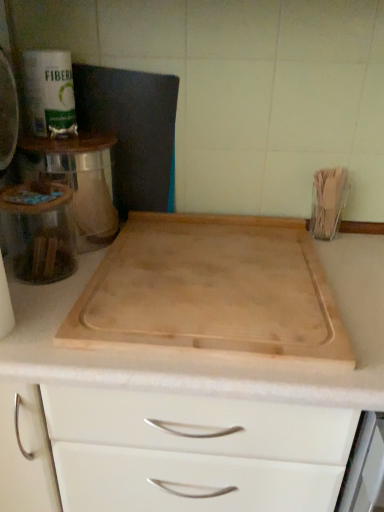
Question: Considering the positions of point (1, 118) and point (34, 283), is point (1, 118) closer or farther from the camera than point (34, 283)?

Choices:
 (A) closer
 (B) farther

Answer: (A)

Question: From their relative heights in the image, would you say metallic silver toaster at upper left, which is counted as the 1th appliance, starting from the top, is taller or shorter than clear glass jar at left, which ranks as the first appliance in right-to-left order?

Choices:
 (A) tall
 (B) short

Answer: (A)

Question: Which object is positioned farthest from the natural wood cutting board at center?

Choices:
 (A) clear glass jar at left, the second appliance positioned from the left
 (B) metallic silver toaster at upper left, which is the first appliance from left to right
 (C) natural wood cutting board at center

Answer: (B)

Question: Which is nearer to the natural wood cutting board at center?

Choices:
 (A) metallic silver toaster at upper left, which ranks as the 2th appliance in right-to-left order
 (B) natural wood cutting board at center
 (C) clear glass jar at left, the second appliance positioned from the top

Answer: (B)